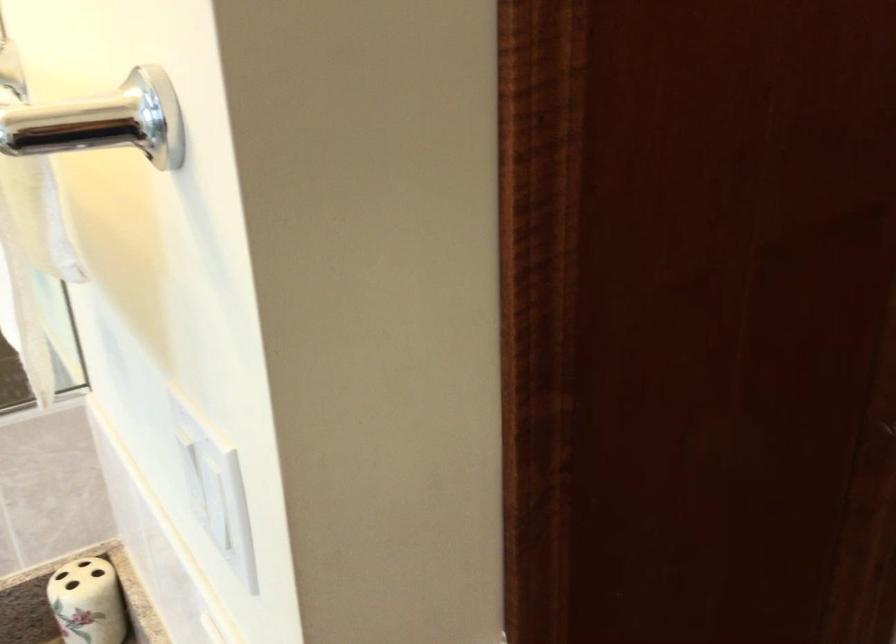
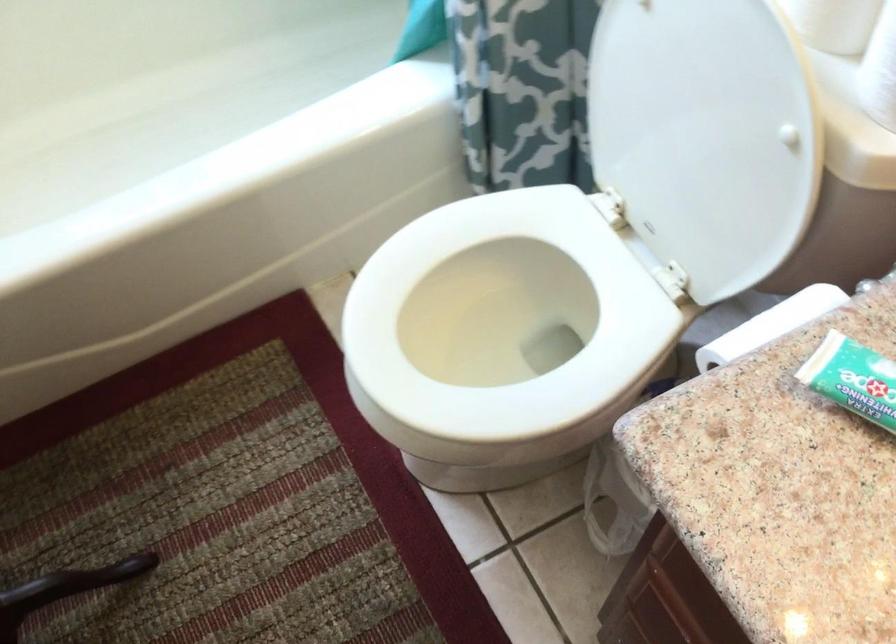
The first image is from the beginning of the video and the second image is from the end. How did the camera likely rotate when shooting the video?

The camera rotated toward left-down.